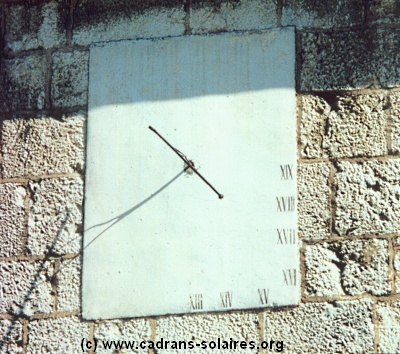
Identify the location of blank space at top of clock. This screenshot has width=400, height=354. (192, 84).